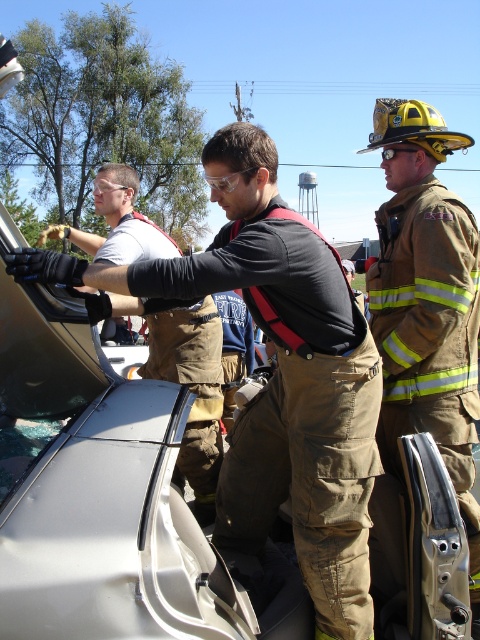
Question: Can you confirm if brown/canvas jumpsuit at center is positioned below transparent glass car window at lower left?

Choices:
 (A) yes
 (B) no

Answer: (A)

Question: Does brown/canvas jumpsuit at center appear under transparent glass car window at lower left?

Choices:
 (A) no
 (B) yes

Answer: (B)

Question: Which point is closer to the camera taking this photo?

Choices:
 (A) (311, 570)
 (B) (73, 413)

Answer: (A)

Question: Observing the image, what is the correct spatial positioning of brown/canvas jumpsuit at center in reference to transparent glass car window at lower left?

Choices:
 (A) right
 (B) left

Answer: (A)

Question: Which point is farther from the camera taking this photo?

Choices:
 (A) (277, 236)
 (B) (98, 365)

Answer: (B)